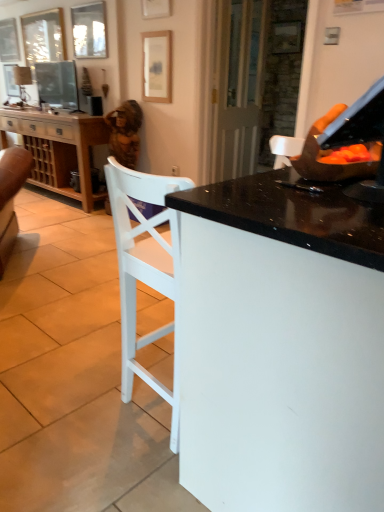
Question: Is matte glass picture frame at upper left, the third picture frame viewed from the right, positioned beyond the bounds of brown textured statue at upper left?

Choices:
 (A) yes
 (B) no

Answer: (A)

Question: Considering the relative sizes of matte glass picture frame at upper left, which is the third picture frame from front to back, and brown textured statue at upper left in the image provided, is matte glass picture frame at upper left, which is the third picture frame from front to back, thinner than brown textured statue at upper left?

Choices:
 (A) no
 (B) yes

Answer: (B)

Question: From a real-world perspective, is matte glass picture frame at upper left, the 3th picture frame when ordered from back to front, beneath brown textured statue at upper left?

Choices:
 (A) yes
 (B) no

Answer: (B)

Question: Considering the relative sizes of matte glass picture frame at upper left, positioned as the third picture frame in left-to-right order, and brown textured statue at upper left in the image provided, is matte glass picture frame at upper left, positioned as the third picture frame in left-to-right order, shorter than brown textured statue at upper left?

Choices:
 (A) yes
 (B) no

Answer: (A)

Question: Is matte glass picture frame at upper left, the 3th picture frame when ordered from back to front, positioned with its back to brown textured statue at upper left?

Choices:
 (A) no
 (B) yes

Answer: (A)

Question: From the image's perspective, is wooden cabinet at left located above or below matte wooden picture frame at upper center, placed as the second picture frame when sorted from right to left?

Choices:
 (A) below
 (B) above

Answer: (A)

Question: Is point (46, 180) closer or farther from the camera than point (168, 82)?

Choices:
 (A) farther
 (B) closer

Answer: (A)

Question: Is wooden cabinet at left inside the boundaries of matte wooden picture frame at upper center, the 4th picture frame in the left-to-right sequence, or outside?

Choices:
 (A) outside
 (B) inside

Answer: (A)

Question: From their relative heights in the image, would you say wooden cabinet at left is taller or shorter than matte wooden picture frame at upper center, placed as the second picture frame when sorted from right to left?

Choices:
 (A) tall
 (B) short

Answer: (A)

Question: In the image, is matte black television at upper left positioned in front of or behind wooden picture frame at upper left, which is the fourth picture frame in right-to-left order?

Choices:
 (A) front
 (B) behind

Answer: (A)

Question: Considering the positions of matte black television at upper left and wooden picture frame at upper left, the 4th picture frame viewed from the front, in the image, is matte black television at upper left bigger or smaller than wooden picture frame at upper left, the 4th picture frame viewed from the front,?

Choices:
 (A) small
 (B) big

Answer: (B)

Question: From the image's perspective, is matte black television at upper left positioned above or below wooden picture frame at upper left, which is the second picture frame in back-to-front order?

Choices:
 (A) above
 (B) below

Answer: (B)

Question: In the image, is matte black television at upper left on the left side or the right side of wooden picture frame at upper left, which is the second picture frame in back-to-front order?

Choices:
 (A) right
 (B) left

Answer: (A)

Question: Visually, is matte wooden picture frame at upper center, marked as the first picture frame in a right-to-left arrangement, positioned to the left or to the right of wooden picture frame at upper left, the 5th picture frame positioned from the front?

Choices:
 (A) left
 (B) right

Answer: (B)

Question: In the image, is matte wooden picture frame at upper center, marked as the first picture frame in a right-to-left arrangement, positioned in front of or behind wooden picture frame at upper left, the 1th picture frame from the left?

Choices:
 (A) behind
 (B) front

Answer: (B)